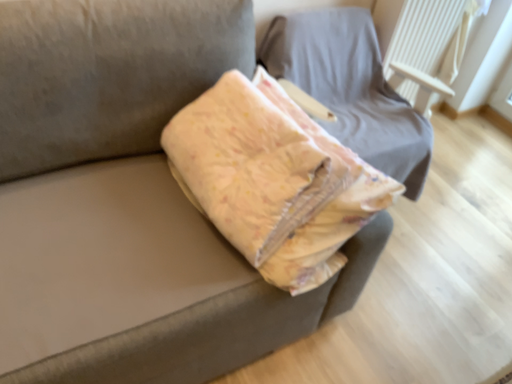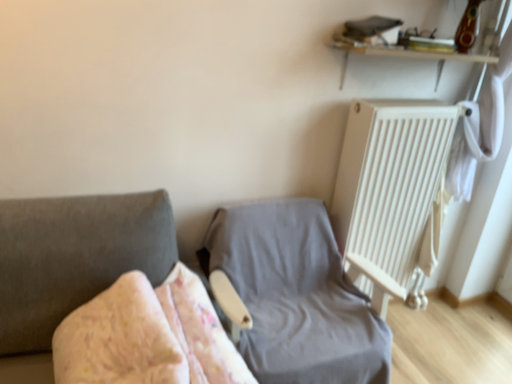
Question: How did the camera likely rotate when shooting the video?

Choices:
 (A) rotated left
 (B) rotated right

Answer: (A)